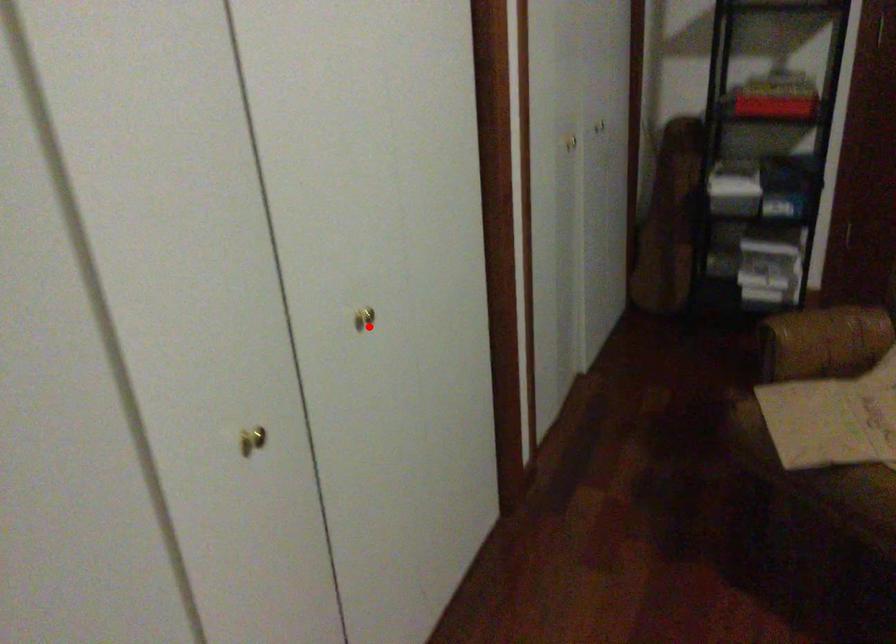
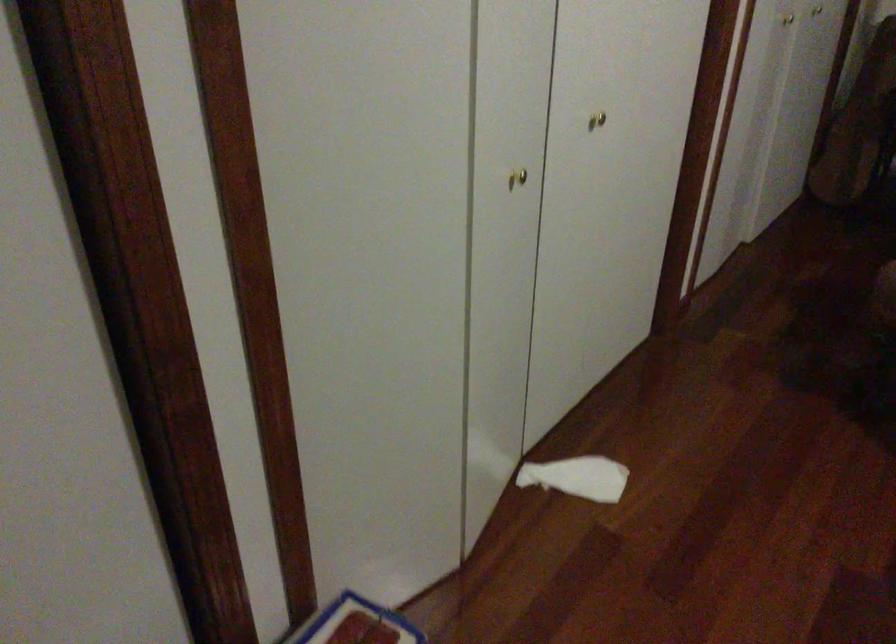
Question: I am providing you with two images of the same scene from different viewpoints. A red point is marked on the first image. At the location where the point appears in image 1, is it still visible in image 2?

Choices:
 (A) Yes
 (B) No

Answer: (A)